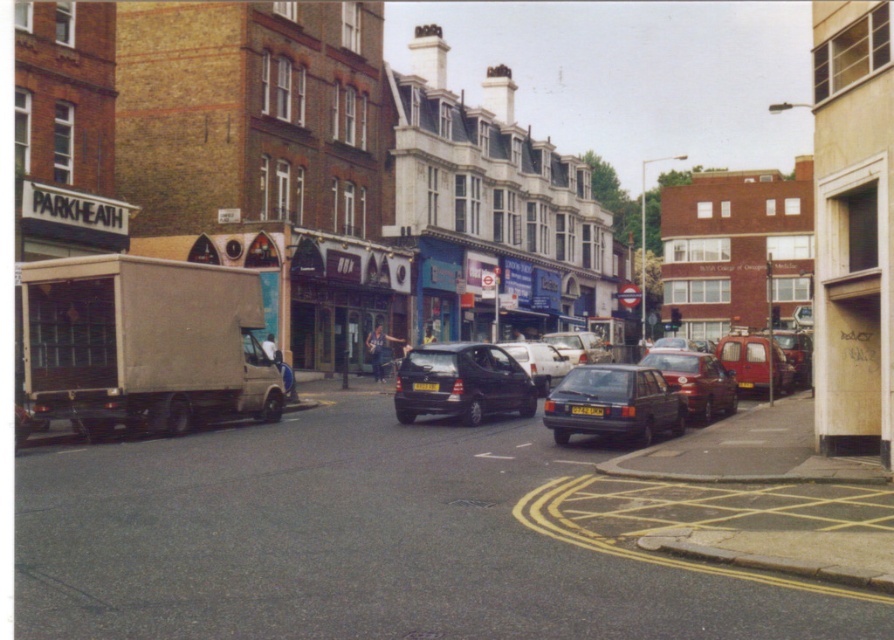
Is point (680, 385) less distant than point (746, 356)?

Yes, point (680, 385) is in front of point (746, 356).

Identify the location of shiny red car at center. (696, 381).

The width and height of the screenshot is (894, 640). I want to click on shiny red car at center, so (x=696, y=381).

You are a GUI agent. You are given a task and a screenshot of the screen. Output one action in this format:
    pyautogui.click(x=<x>, y=<y>)
    Task: Click on the shiny red car at center
    The image size is (894, 640).
    Given the screenshot: What is the action you would take?
    pyautogui.click(x=696, y=381)

Is point (682, 355) farther from viewer compared to point (595, 406)?

Yes.

Does shiny red car at center have a larger size compared to yellow matte license plate at center?

Yes, shiny red car at center is bigger than yellow matte license plate at center.

Image resolution: width=894 pixels, height=640 pixels. What are the coordinates of `shiny red car at center` in the screenshot? It's located at (696, 381).

The height and width of the screenshot is (640, 894). Find the location of `shiny red car at center`. shiny red car at center is located at coordinates (696, 381).

Does point (550, 378) come behind point (584, 344)?

No, (550, 378) is closer to viewer.

This screenshot has width=894, height=640. Find the location of `white matte van at center`. white matte van at center is located at coordinates (538, 362).